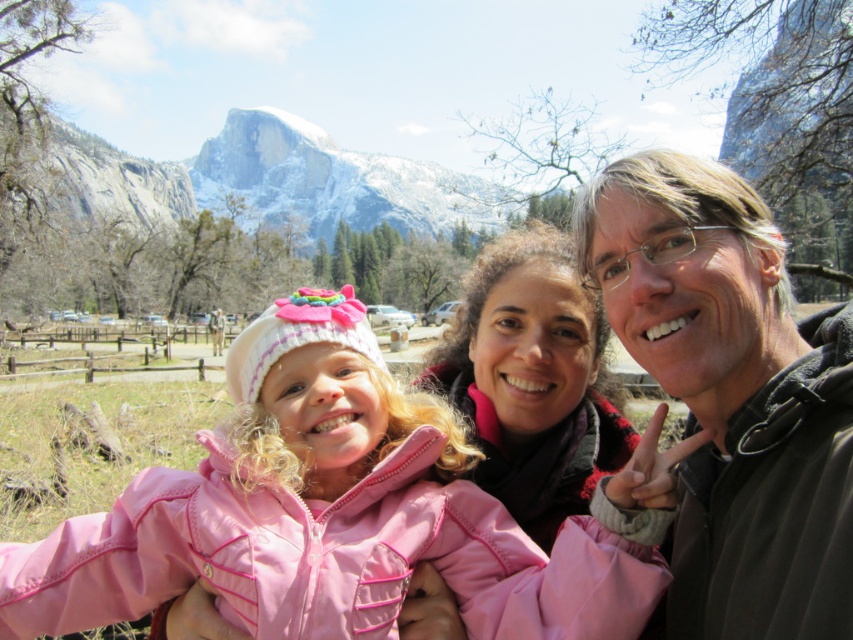
You are trying to identify the clothing items in the photo. According to the scene, which jacket is located below the other between the dark brown fleece jacket at right and the matte pink jacket at center?

The dark brown fleece jacket at right is positioned under the matte pink jacket at center.

You are a photographer adjusting camera settings. You need to focus on the matte black jacket at right and the matte pink jacket at center. Which jacket should you adjust the focus for first if you want to ensure both are in focus, considering their heights?

The matte black jacket at right has a greater height compared to the matte pink jacket at center. Since it is taller, you should focus on the matte black jacket at right first to ensure both are in focus.